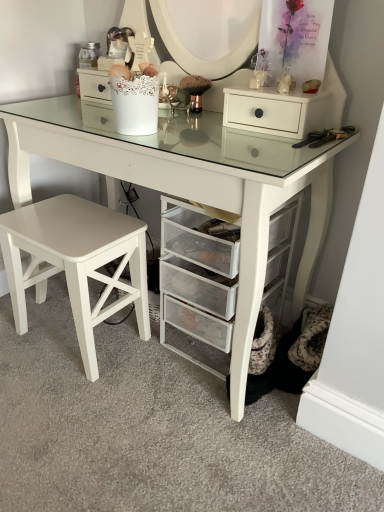
The height and width of the screenshot is (512, 384). I want to click on free point above white matte drawer at upper right (from a real-world perspective), so click(x=274, y=89).